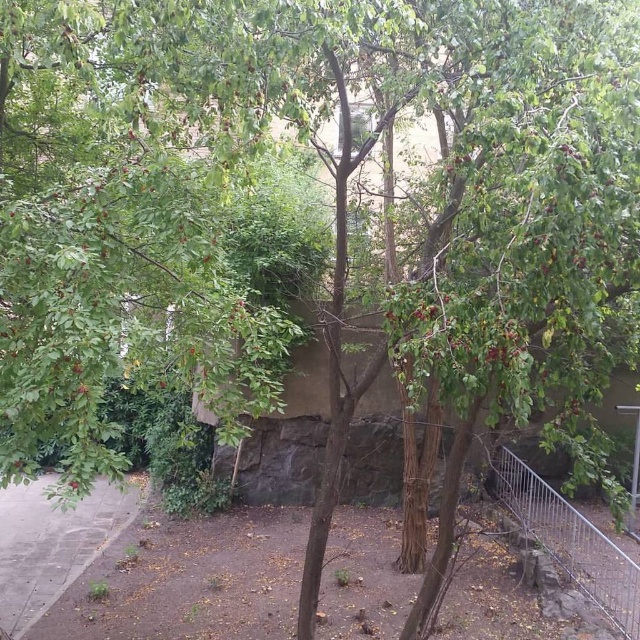
Question: Which of the following is the closest to the observer?

Choices:
 (A) gray concrete pavement at lower left
 (B) green matte leaves at center
 (C) silver metallic fence at right

Answer: (B)

Question: Estimate the real-world distances between objects in this image. Which object is farther from the gray concrete pavement at lower left?

Choices:
 (A) silver metallic fence at right
 (B) green matte leaves at center

Answer: (B)

Question: Observing the image, what is the correct spatial positioning of gray concrete pavement at lower left in reference to green matte leaves at center?

Choices:
 (A) below
 (B) above

Answer: (A)

Question: Does gray concrete pavement at lower left have a greater width compared to silver metallic fence at right?

Choices:
 (A) no
 (B) yes

Answer: (B)

Question: Which object is farther from the camera taking this photo?

Choices:
 (A) silver metallic fence at right
 (B) gray concrete pavement at lower left
 (C) green matte leaves at center

Answer: (B)

Question: Can you confirm if gray concrete pavement at lower left is positioned to the right of silver metallic fence at right?

Choices:
 (A) yes
 (B) no

Answer: (B)